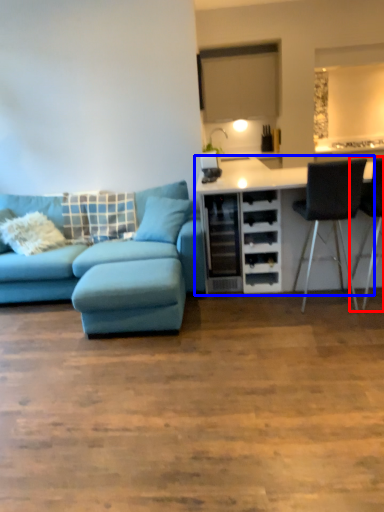
Question: Which of the following is the closest to the observer, chair (highlighted by a red box) or cabinetry (highlighted by a blue box)?

Choices:
 (A) chair
 (B) cabinetry

Answer: (A)